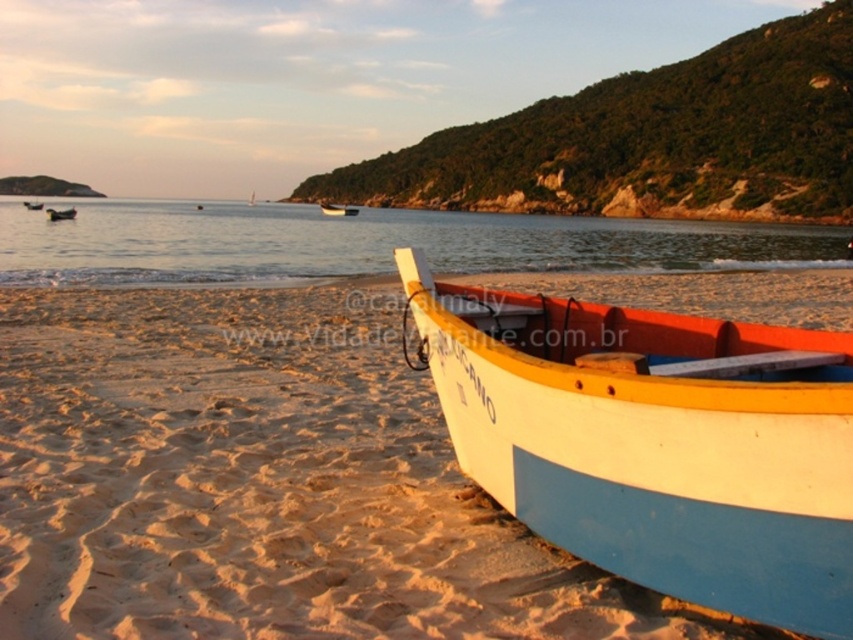
Which is behind, point (730, 592) or point (218, 221)?

The point (218, 221) is more distant.

Who is more forward, [631,460] or [99,246]?

Point [631,460]

Is point (604, 536) closer to camera compared to point (74, 253)?

Yes, it is.

At what (x,y) coordinates should I click in order to perform the action: click on white painted wood boat at lower right. Please return your answer as a coordinate pair (x, y). This screenshot has width=853, height=640. Looking at the image, I should click on (656, 442).

Find the location of a particular element. This screenshot has height=640, width=853. white painted wood boat at lower right is located at coordinates (656, 442).

Does point (799, 381) come farther from viewer compared to point (32, 204)?

That is False.

Find the location of a particular element. Image resolution: width=853 pixels, height=640 pixels. white painted wood boat at lower right is located at coordinates (656, 442).

Can you confirm if clear water at center is shorter than matte black boat at left?

In fact, clear water at center may be taller than matte black boat at left.

Who is more forward, (270, 268) or (57, 220)?

Positioned in front is point (270, 268).

Image resolution: width=853 pixels, height=640 pixels. I want to click on clear water at center, so [x=373, y=243].